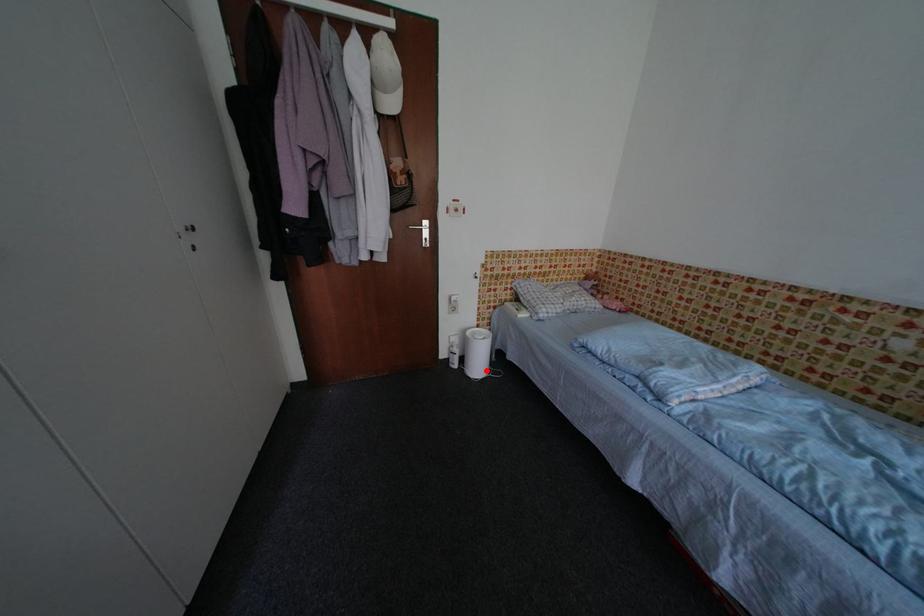
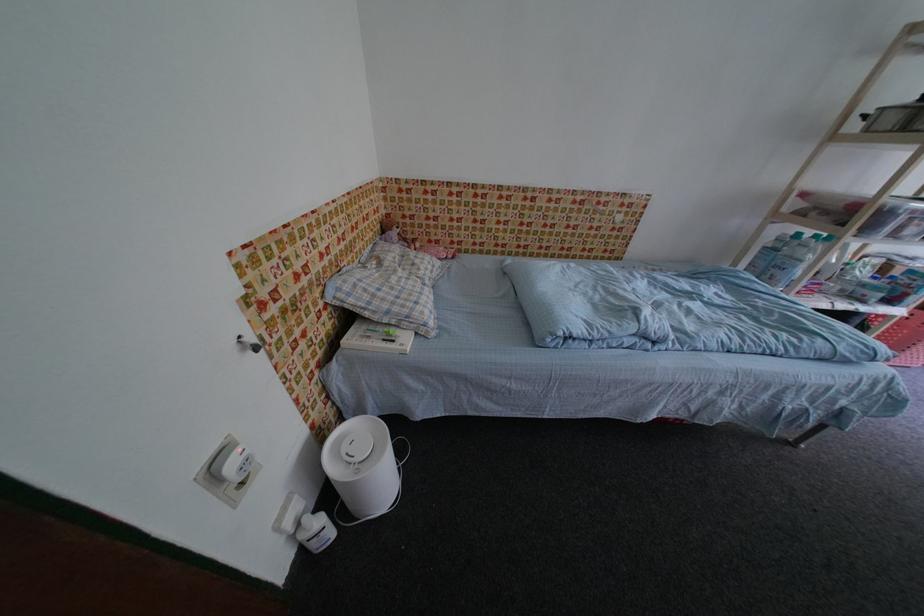
The point at the highlighted location is marked in the first image. Where is the corresponding point in the second image?

(391, 485)